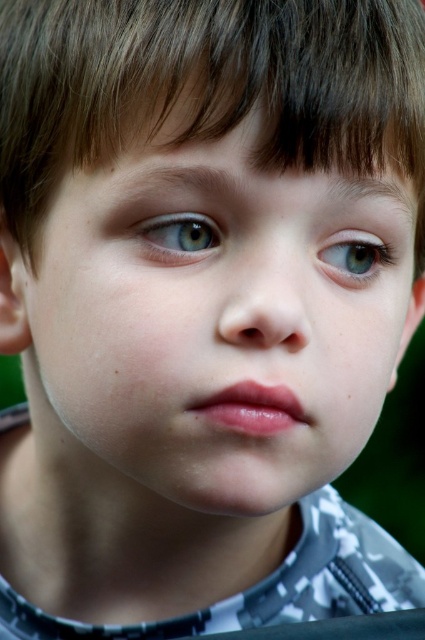
Question: Which object is the farthest from the smooth skin face at center?

Choices:
 (A) light blue eye at center
 (B) green matte eye at upper left

Answer: (A)

Question: Is smooth skin face at center to the right of light blue eye at center from the viewer's perspective?

Choices:
 (A) no
 (B) yes

Answer: (A)

Question: Which point is farther to the camera?

Choices:
 (A) smooth skin face at center
 (B) light blue eye at center

Answer: (B)

Question: Can you confirm if light blue eye at center is positioned to the left of green matte eye at upper left?

Choices:
 (A) no
 (B) yes

Answer: (A)

Question: Is light blue eye at center thinner than green matte eye at upper left?

Choices:
 (A) yes
 (B) no

Answer: (B)

Question: Among these points, which one is farthest from the camera?

Choices:
 (A) (226, 157)
 (B) (343, 228)

Answer: (B)